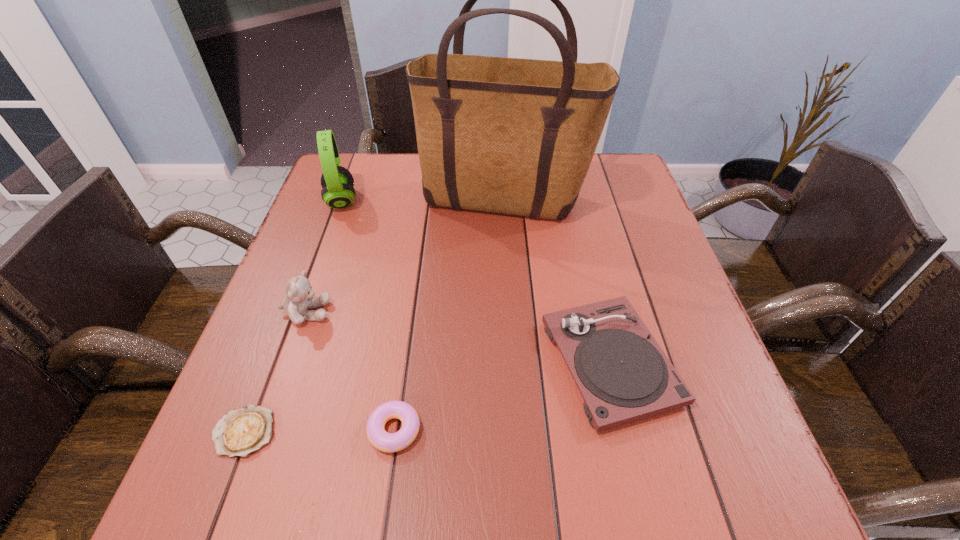
Find the location of `object at the far right corner`. object at the far right corner is located at coordinates (515, 136).

You are a GUI agent. You are given a task and a screenshot of the screen. Output one action in this format:
    pyautogui.click(x=<x>, y=<y>)
    Task: Click on the blank area at the near edge
    
    Given the screenshot: What is the action you would take?
    pyautogui.click(x=613, y=469)

Locate an element on the screen. free spot at the left edge of the desktop is located at coordinates (286, 312).

Identify the location of free location at the right edge of the desktop. (667, 291).

The image size is (960, 540). Find the location of `blank region between the teddy bear and the tallest object`. blank region between the teddy bear and the tallest object is located at coordinates (405, 257).

The image size is (960, 540). In order to click on vacant area between the fourth tallest object and the teddy bear in this screenshot , I will do `click(458, 337)`.

Find the location of a particular element. The height and width of the screenshot is (540, 960). empty space between the tote bag and the headset is located at coordinates (422, 201).

What are the coordinates of `blank region between the shortest object and the third shortest object` in the screenshot? It's located at (427, 397).

Where is `vacant region between the headset and the tallest object`? The width and height of the screenshot is (960, 540). vacant region between the headset and the tallest object is located at coordinates (422, 201).

Identify the location of free space between the fifth tallest object and the teddy bear. This screenshot has height=540, width=960. (350, 371).